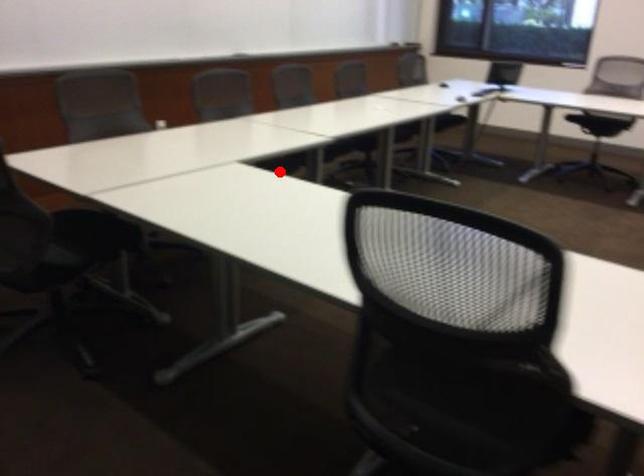
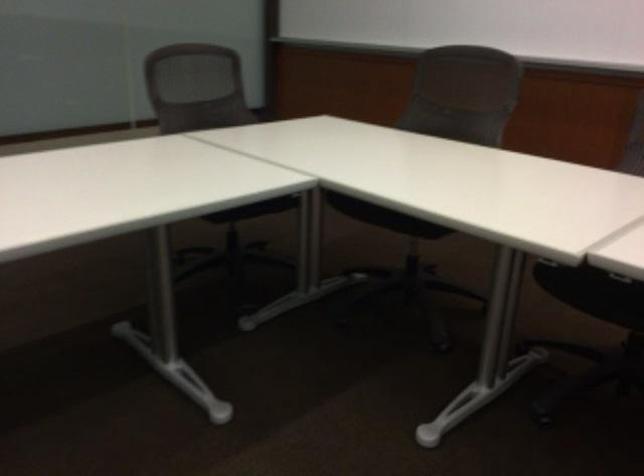
Question: I am providing you with two images of the same scene from different viewpoints. Given a red point in image1, look at the same physical point in image2. Is it:

Choices:
 (A) Closer to the viewpoint
 (B) Farther from the viewpoint

Answer: (A)